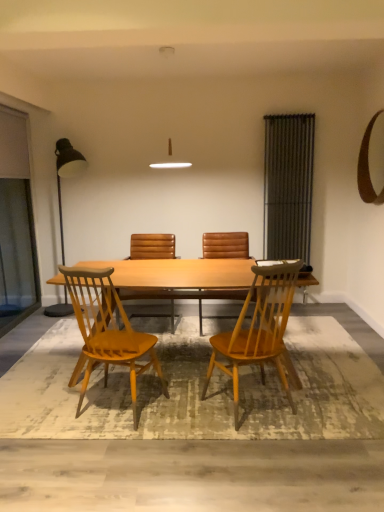
Question: Does metallic black floor lamp at left have a lesser width compared to metallic gray radiator at right, which ranks as the second screen door in left-to-right order?

Choices:
 (A) no
 (B) yes

Answer: (A)

Question: Is metallic black floor lamp at left oriented towards metallic gray radiator at right, which ranks as the second screen door in left-to-right order?

Choices:
 (A) no
 (B) yes

Answer: (A)

Question: From the image's perspective, does metallic black floor lamp at left appear lower than metallic gray radiator at right, which ranks as the second screen door in left-to-right order?

Choices:
 (A) yes
 (B) no

Answer: (A)

Question: Can you confirm if metallic black floor lamp at left is smaller than metallic gray radiator at right, which ranks as the second screen door in left-to-right order?

Choices:
 (A) no
 (B) yes

Answer: (A)

Question: Is metallic black floor lamp at left positioned before metallic gray radiator at right, the first screen door when ordered from right to left?

Choices:
 (A) no
 (B) yes

Answer: (B)

Question: Is metallic gray radiator at right, which ranks as the second screen door in left-to-right order, situated inside transparent glass screen door at left, placed as the 1th screen door when sorted from left to right, or outside?

Choices:
 (A) inside
 (B) outside

Answer: (B)

Question: Is metallic gray radiator at right, the first screen door when ordered from right to left, bigger or smaller than transparent glass screen door at left, placed as the 1th screen door when sorted from left to right?

Choices:
 (A) big
 (B) small

Answer: (B)

Question: Is metallic gray radiator at right, the first screen door when ordered from right to left, taller or shorter than transparent glass screen door at left, placed as the 1th screen door when sorted from left to right?

Choices:
 (A) tall
 (B) short

Answer: (B)

Question: Considering their positions, is metallic gray radiator at right, which ranks as the second screen door in left-to-right order, located in front of or behind transparent glass screen door at left, marked as the 2th screen door in a right-to-left arrangement?

Choices:
 (A) behind
 (B) front

Answer: (A)

Question: Is point (18, 206) closer or farther from the camera than point (130, 245)?

Choices:
 (A) closer
 (B) farther

Answer: (B)

Question: In terms of height, does transparent glass screen door at left, placed as the 1th screen door when sorted from left to right, look taller or shorter compared to brown leather chair at center, arranged as the 4th chair when viewed from the front?

Choices:
 (A) tall
 (B) short

Answer: (A)

Question: Would you say transparent glass screen door at left, placed as the 1th screen door when sorted from left to right, is to the left or to the right of brown leather chair at center, placed as the first chair when sorted from back to front, in the picture?

Choices:
 (A) left
 (B) right

Answer: (A)

Question: From a real-world perspective, is transparent glass screen door at left, placed as the 1th screen door when sorted from left to right, above or below brown leather chair at center, placed as the first chair when sorted from back to front?

Choices:
 (A) above
 (B) below

Answer: (A)

Question: From a real-world perspective, relative to brown leather chair at center, placed as the first chair when sorted from back to front, is metallic black floor lamp at left vertically above or below?

Choices:
 (A) above
 (B) below

Answer: (A)

Question: Is metallic black floor lamp at left bigger or smaller than brown leather chair at center, arranged as the 4th chair when viewed from the front?

Choices:
 (A) small
 (B) big

Answer: (B)